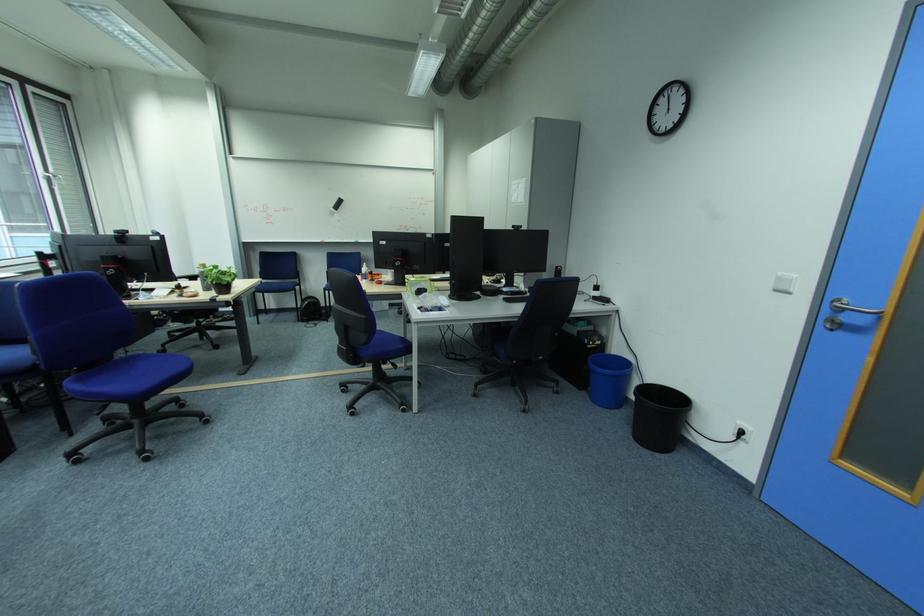
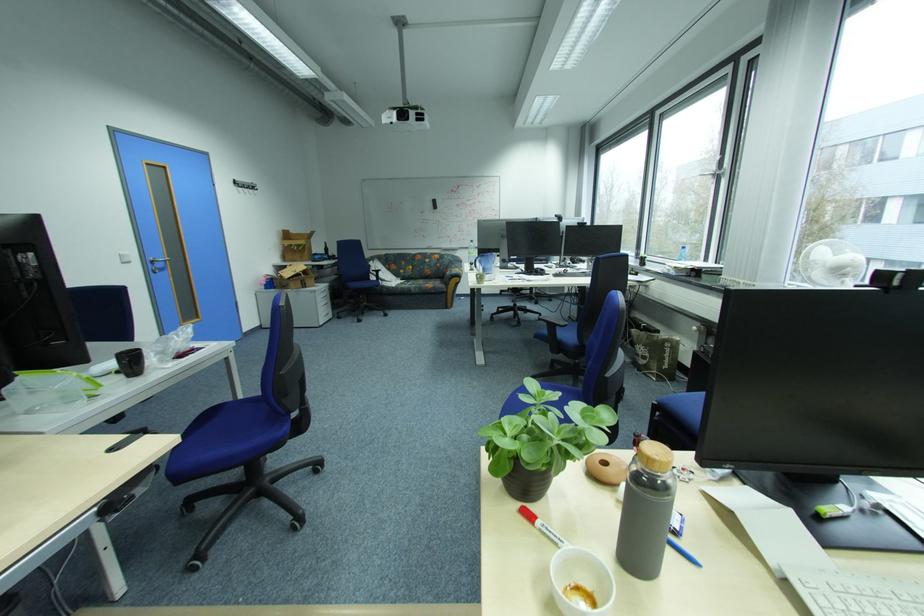
Locate, in the second image, the point that corresponds to point (856, 318) in the first image.

(167, 265)